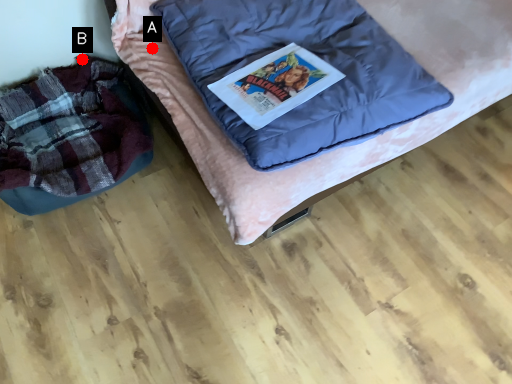
Question: Two points are circled on the image, labeled by A and B beside each circle. Which point is closer to the camera?

Choices:
 (A) A is closer
 (B) B is closer

Answer: (A)